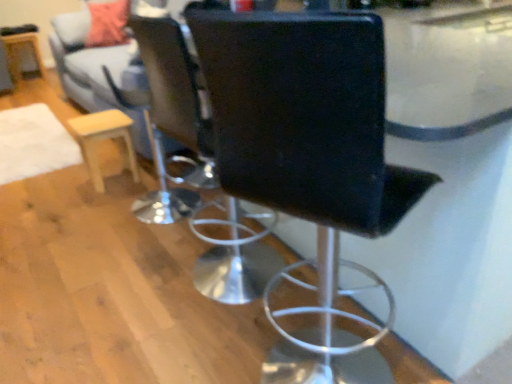
You are a GUI agent. You are given a task and a screenshot of the screen. Output one action in this format:
    pyautogui.click(x=<x>, y=<y>)
    Task: Click on the free space that is in between black leather chair at center, the 2th chair when ordered from back to front, and black leather chair at center, arranged as the first chair when viewed from the back
    The height and width of the screenshot is (384, 512).
    Given the screenshot: What is the action you would take?
    pyautogui.click(x=244, y=329)